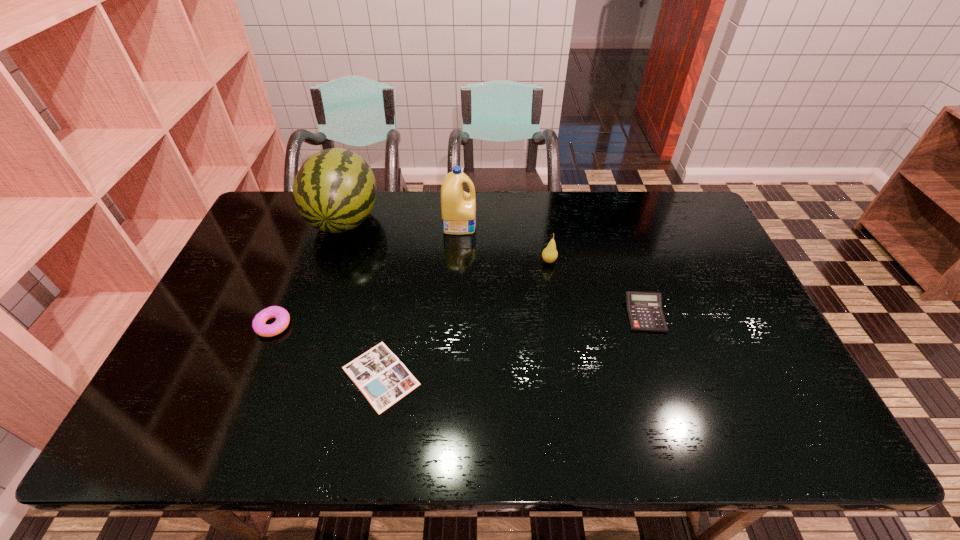
The width and height of the screenshot is (960, 540). I want to click on vacant space situated on the right of the pear, so click(640, 261).

You are a GUI agent. You are given a task and a screenshot of the screen. Output one action in this format:
    pyautogui.click(x=<x>, y=<y>)
    Task: Click on the vacant area situated 0.260m on the right of the doughnut
    Image resolution: width=960 pixels, height=540 pixels.
    Given the screenshot: What is the action you would take?
    pyautogui.click(x=387, y=325)

At what (x,y) coordinates should I click in order to perform the action: click on vacant space located on the back of the calculator. Please return your answer as a coordinate pair (x, y). Looking at the image, I should click on (616, 230).

This screenshot has width=960, height=540. I want to click on free spot located on the back of the shortest object, so [393, 309].

The image size is (960, 540). I want to click on watermelon located at the far edge, so click(x=334, y=191).

Find the location of a particular element. detergent that is at the far edge is located at coordinates (458, 208).

Identify the location of object that is positioned at the near edge. pos(383,379).

This screenshot has width=960, height=540. Find the location of `object situated at the left edge`. object situated at the left edge is located at coordinates (282, 316).

In the image, there is a desktop. At what (x,y) coordinates should I click in order to perform the action: click on vacant area at the far edge. Please return your answer as a coordinate pair (x, y). Looking at the image, I should click on (387, 213).

Identify the location of vacant space at the near edge. (556, 428).